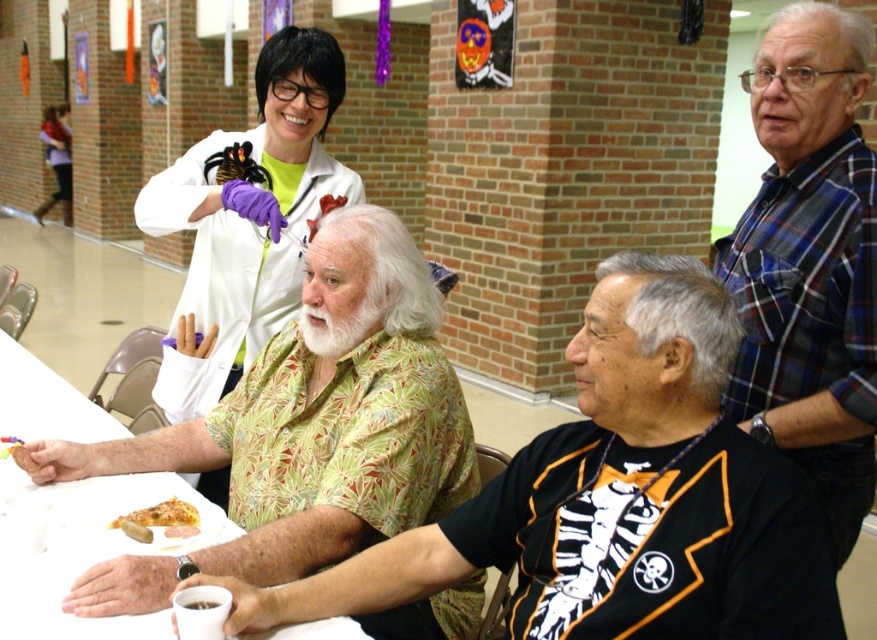
Does point (740, 372) come behind point (0, 449)?

No, it is in front of (0, 449).

I want to click on blue plaid shirt at upper right, so click(x=810, y=260).

The height and width of the screenshot is (640, 877). Identify the location of blue plaid shirt at upper right. click(x=810, y=260).

Is point (769, 273) in front of point (59, 198)?

Yes, it is in front of point (59, 198).

Who is lower down, blue plaid shirt at upper right or matte white lab coat at upper left?

blue plaid shirt at upper right is lower down.

Identify the location of blue plaid shirt at upper right. (810, 260).

Locate an element on the screen. The height and width of the screenshot is (640, 877). blue plaid shirt at upper right is located at coordinates (810, 260).

Does green leafy shirt at center have a lesser height compared to matte white lab coat at upper left?

Yes, green leafy shirt at center is shorter than matte white lab coat at upper left.

Does green leafy shirt at center have a greater width compared to matte white lab coat at upper left?

Yes, green leafy shirt at center is wider than matte white lab coat at upper left.

Identify the location of green leafy shirt at center. The height and width of the screenshot is (640, 877). (305, 428).